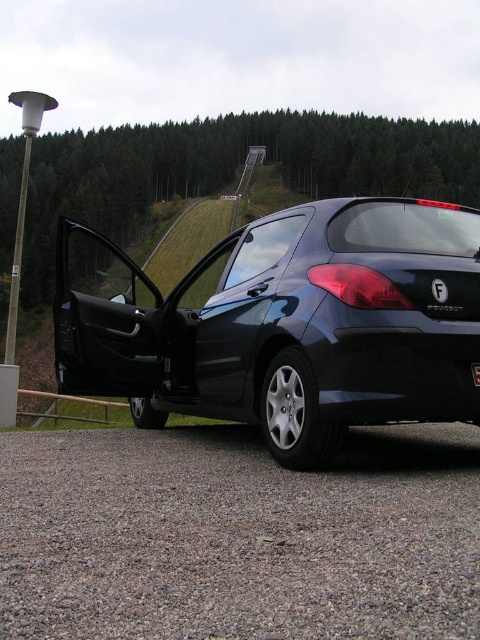
You are standing in front of a dark Peugeot 207 parked on gravel near a ski resort. You have a drone that needs to fly to a specific point at coordinates point (396, 356). The drone can only fly up to 8 feet away. Will the drone be able to reach that point?

The distance of point (396, 356) from the camera is 7.71 feet, which is within the drone maximum range of 8 feet. Yes, the drone can reach the point.

You are a delivery person trying to park your van next to the glossy dark blue hatchback at center and the black plastic license plate at center. Which side should you park on to avoid blocking the license plate?

You should park to the right side of the glossy dark blue hatchback at center because it is positioned to the left of the black plastic license plate at center, so parking on the right would keep the license plate visible and unobstructed.

You are standing in front of the dark Peugeot 207 with the open driver door. You notice two points marked on the car. One is at point coordinates (90,260) and the other at (478,381). Which point is closer to you?

Point (90,260) is closer to you because it is further to the viewer than point (478,381).